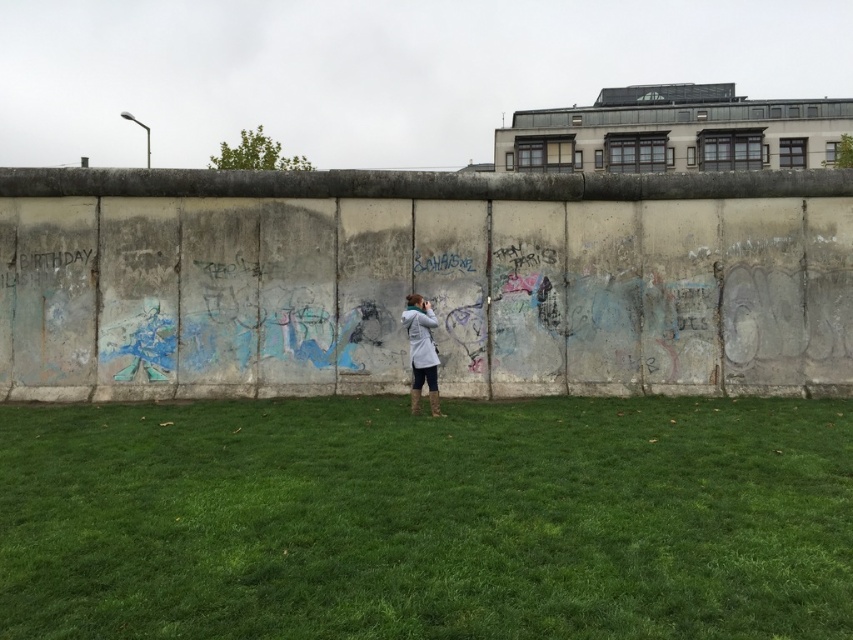
Question: Does green grass at center appear on the left side of light gray fabric jacket at center?

Choices:
 (A) no
 (B) yes

Answer: (A)

Question: Is green grass at center wider than light gray fabric jacket at center?

Choices:
 (A) no
 (B) yes

Answer: (A)

Question: Which point is closer to the camera?

Choices:
 (A) (131, 548)
 (B) (431, 310)

Answer: (A)

Question: Which object is farther from the camera taking this photo?

Choices:
 (A) light gray fabric jacket at center
 (B) green grass at center

Answer: (A)

Question: Does green grass at center appear on the left side of light gray fabric jacket at center?

Choices:
 (A) no
 (B) yes

Answer: (A)